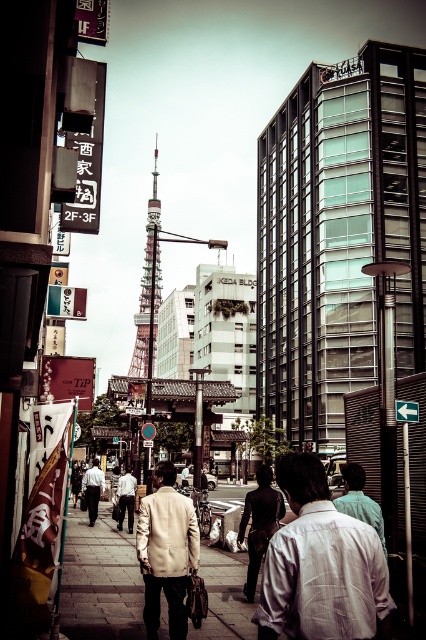
Does white textured shirt at center appear over light beige jacket at center?

Correct, white textured shirt at center is located above light beige jacket at center.

What do you see at coordinates (322, 566) in the screenshot?
I see `white textured shirt at center` at bounding box center [322, 566].

Does point (264, 611) come in front of point (131, 524)?

Yes.

Where is `white textured shirt at center`? Image resolution: width=426 pixels, height=640 pixels. white textured shirt at center is located at coordinates (322, 566).

Locate an element on the screen. Image resolution: width=426 pixels, height=640 pixels. white textured shirt at center is located at coordinates (322, 566).

Is white textured shirt at center wider than brick pavement at center?

No, white textured shirt at center is not wider than brick pavement at center.

Does point (307, 458) lie in front of point (63, 586)?

Yes, point (307, 458) is closer to viewer.

Where is `white textured shirt at center`? This screenshot has height=640, width=426. white textured shirt at center is located at coordinates (322, 566).

Which is below, beige fabric jacket at center or light beige suit at center?

light beige suit at center is below.

Who is more distant from viewer, (152, 509) or (95, 492)?

The point (95, 492) is more distant.

Identify the location of beige fabric jacket at center. pyautogui.click(x=166, y=550).